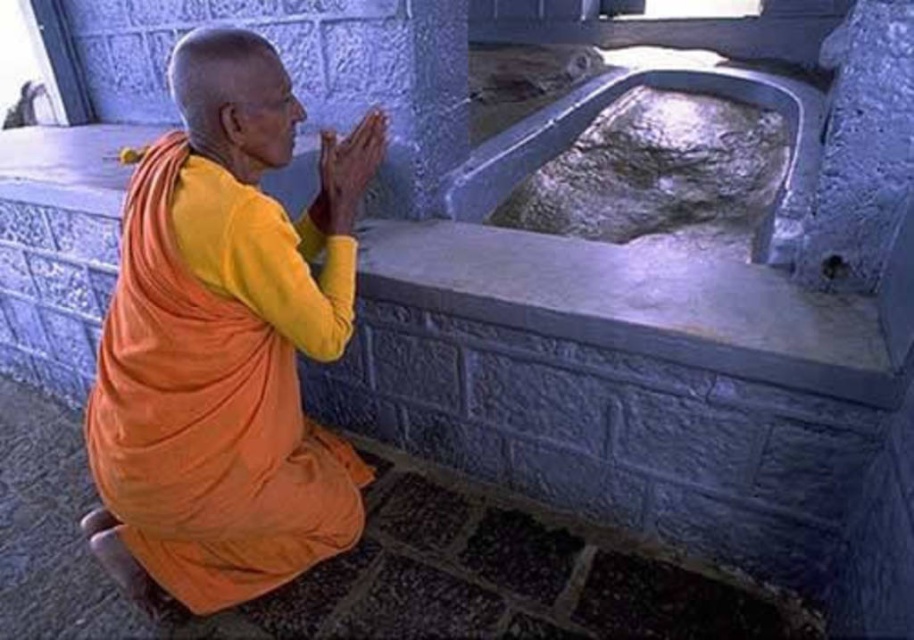
Question: Which of the following is the closest to the observer?

Choices:
 (A) pos(101,492)
 (B) pos(328,152)

Answer: (A)

Question: Is orange cloth at center in front of matte orange hands at center?

Choices:
 (A) yes
 (B) no

Answer: (A)

Question: Is the position of orange cloth at center less distant than that of matte orange hands at center?

Choices:
 (A) no
 (B) yes

Answer: (B)

Question: Among these objects, which one is farthest from the camera?

Choices:
 (A) orange cloth at center
 (B) matte orange hands at center

Answer: (B)

Question: Observing the image, what is the correct spatial positioning of orange cloth at center in reference to matte orange hands at center?

Choices:
 (A) above
 (B) below

Answer: (B)